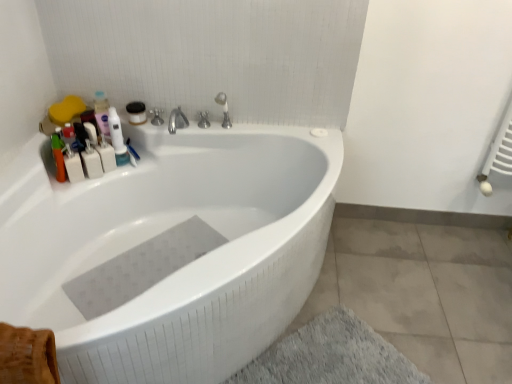
Where is `vacant space situated above gray soft bath mat at lower right (from a real-world perspective)`? The image size is (512, 384). vacant space situated above gray soft bath mat at lower right (from a real-world perspective) is located at coordinates (330, 357).